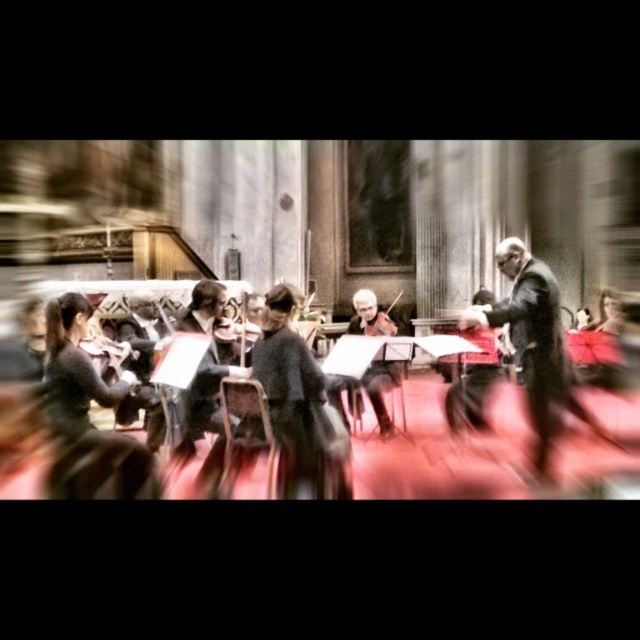
Question: Which of the following is the closest to the observer?

Choices:
 (A) (362, 314)
 (B) (221, 321)
 (C) (460, 493)

Answer: (C)

Question: Is black suit at center below shiny black violin at center?

Choices:
 (A) yes
 (B) no

Answer: (A)

Question: Can you confirm if shiny black violin at center is smaller than wooden violin at center?

Choices:
 (A) no
 (B) yes

Answer: (A)

Question: Which object is closer to the camera taking this photo?

Choices:
 (A) wooden violin at center
 (B) black glossy violin at center
 (C) black suit at center
 (D) shiny black violin at center

Answer: (B)

Question: Which object is the farthest from the black suit at center?

Choices:
 (A) black glossy violin at center
 (B) shiny black violin at center
 (C) wooden violin at center

Answer: (B)

Question: Can you confirm if black glossy violin at center is positioned to the left of black suit at center?

Choices:
 (A) yes
 (B) no

Answer: (A)